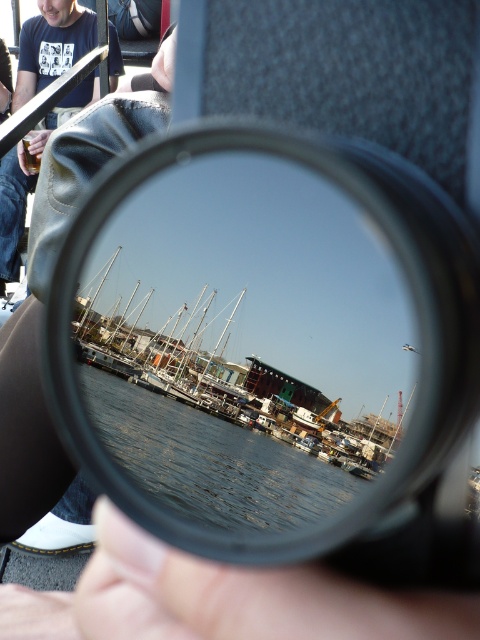
Question: Is smooth skin hand at center wider than dark blue leather jacket at upper left?

Choices:
 (A) no
 (B) yes

Answer: (A)

Question: Does smooth skin hand at center appear on the right side of dark blue leather jacket at upper left?

Choices:
 (A) yes
 (B) no

Answer: (A)

Question: Is transparent plastic lens at center thinner than clear water at center?

Choices:
 (A) no
 (B) yes

Answer: (B)

Question: Which is farther from the smooth skin hand at center?

Choices:
 (A) transparent plastic lens at center
 (B) clear water at center
 (C) dark blue leather jacket at upper left

Answer: (B)

Question: Which point is farther to the camera?

Choices:
 (A) clear water at center
 (B) dark blue leather jacket at upper left
 (C) smooth skin hand at center

Answer: (B)

Question: Which point appears farthest from the camera in this image?

Choices:
 (A) (193, 588)
 (B) (223, 200)
 (C) (290, 490)
 (D) (25, 177)

Answer: (D)